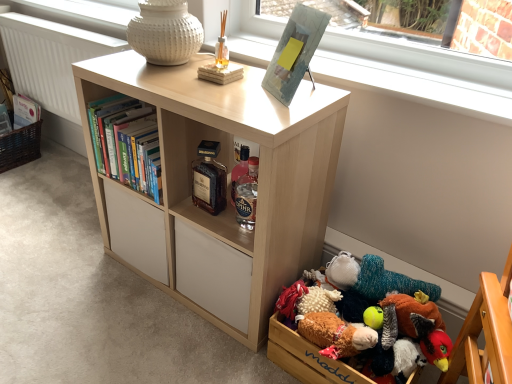
In order to click on free space to the left of light wood bookcase at center in this screenshot , I will do `click(81, 300)`.